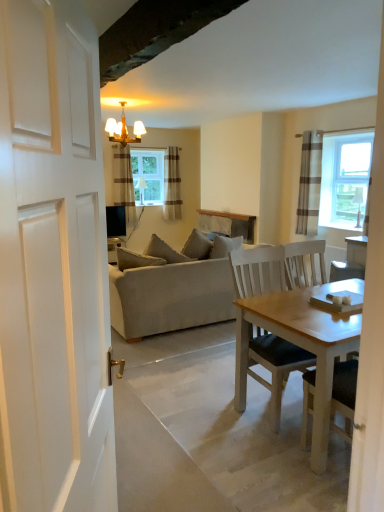
Question: Is striped fabric curtain at center, marked as the 3th curtain in a right-to-left arrangement, at the left side of clear glass window at center?

Choices:
 (A) yes
 (B) no

Answer: (A)

Question: From a real-world perspective, is striped fabric curtain at center, the second curtain when ordered from front to back, positioned over clear glass window at center based on gravity?

Choices:
 (A) yes
 (B) no

Answer: (B)

Question: Is striped fabric curtain at center, which appears as the first curtain when viewed from the left, outside of clear glass window at center?

Choices:
 (A) yes
 (B) no

Answer: (A)

Question: Is striped fabric curtain at center, the second curtain when ordered from front to back, beside clear glass window at center?

Choices:
 (A) no
 (B) yes

Answer: (A)

Question: From a real-world perspective, is striped fabric curtain at center, the second curtain when ordered from front to back, physically below clear glass window at center?

Choices:
 (A) no
 (B) yes

Answer: (B)

Question: Is point pyautogui.click(x=172, y=164) positioned closer to the camera than point pyautogui.click(x=200, y=297)?

Choices:
 (A) closer
 (B) farther

Answer: (B)

Question: Visually, is brown striped curtain at upper center, the 1th curtain when ordered from back to front, positioned to the left or to the right of beige fabric couch at center?

Choices:
 (A) left
 (B) right

Answer: (A)

Question: From the image's perspective, relative to beige fabric couch at center, is brown striped curtain at upper center, the 1th curtain when ordered from back to front, above or below?

Choices:
 (A) above
 (B) below

Answer: (A)

Question: Choose the correct answer: Is brown striped curtain at upper center, the 2th curtain in the left-to-right sequence, inside beige fabric couch at center or outside it?

Choices:
 (A) outside
 (B) inside

Answer: (A)

Question: Visually, is gold metallic chandelier at upper center positioned to the left or to the right of brown striped curtain at upper center, the 1th curtain when ordered from back to front?

Choices:
 (A) left
 (B) right

Answer: (A)

Question: Is gold metallic chandelier at upper center taller or shorter than brown striped curtain at upper center, which is the second curtain from right to left?

Choices:
 (A) short
 (B) tall

Answer: (A)

Question: Is gold metallic chandelier at upper center bigger or smaller than brown striped curtain at upper center, acting as the 3th curtain starting from the front?

Choices:
 (A) small
 (B) big

Answer: (B)

Question: Is gold metallic chandelier at upper center inside the boundaries of brown striped curtain at upper center, which is the second curtain from right to left, or outside?

Choices:
 (A) inside
 (B) outside

Answer: (B)

Question: From a real-world perspective, is clear glass window at center positioned above or below brown striped curtain at upper center, which is the second curtain from right to left?

Choices:
 (A) above
 (B) below

Answer: (A)

Question: Which is correct: clear glass window at center is inside brown striped curtain at upper center, the 2th curtain in the left-to-right sequence, or outside of it?

Choices:
 (A) inside
 (B) outside

Answer: (B)